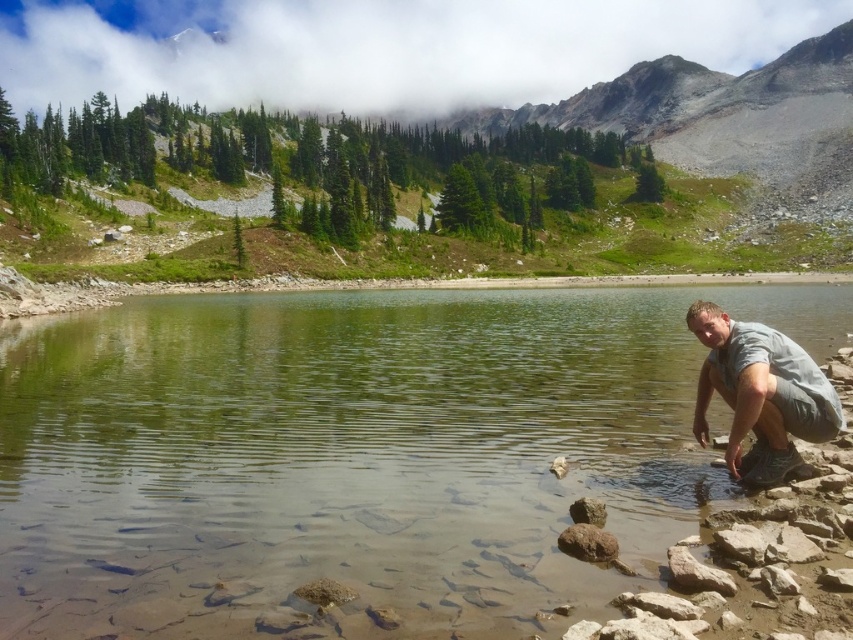
Who is more forward, [329,454] or [743,424]?

Point [743,424]

Where is `clear water at lower right`? This screenshot has width=853, height=640. clear water at lower right is located at coordinates (352, 452).

You are a GUI agent. You are given a task and a screenshot of the screen. Output one action in this format:
    pyautogui.click(x=<x>, y=<y>)
    Task: Click on the clear water at lower right
    The height and width of the screenshot is (640, 853).
    Given the screenshot: What is the action you would take?
    pyautogui.click(x=352, y=452)